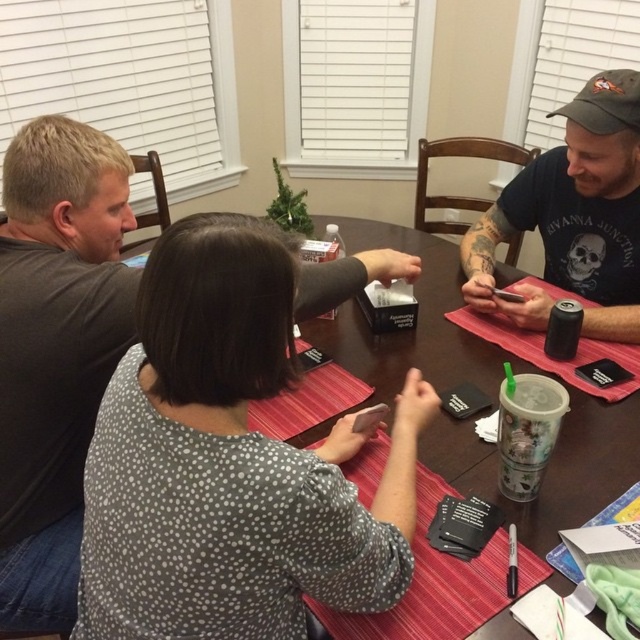
Question: Among these points, which one is farthest from the camera?

Choices:
 (A) tap(128, 525)
 (B) tap(634, 284)

Answer: (B)

Question: Does white dotted shirt at center appear over dark gray cap at upper right?

Choices:
 (A) no
 (B) yes

Answer: (A)

Question: Considering the relative positions of white dotted shirt at center and dark gray cap at upper right in the image provided, where is white dotted shirt at center located with respect to dark gray cap at upper right?

Choices:
 (A) below
 (B) above

Answer: (A)

Question: Which point is closer to the camera?

Choices:
 (A) tap(632, 164)
 (B) tap(209, 573)

Answer: (B)

Question: Which of the following is the farthest from the observer?

Choices:
 (A) (484, 307)
 (B) (394, 557)

Answer: (A)

Question: Does white dotted shirt at center have a smaller size compared to dark gray cap at upper right?

Choices:
 (A) no
 (B) yes

Answer: (A)